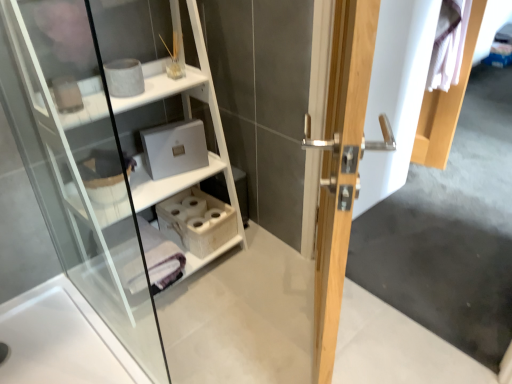
Question: Looking at their shapes, would you say white wood shelf at upper left is wider or thinner than light wood door handle at center?

Choices:
 (A) wide
 (B) thin

Answer: (A)

Question: Based on their sizes in the image, would you say white wood shelf at upper left is bigger or smaller than light wood door handle at center?

Choices:
 (A) small
 (B) big

Answer: (B)

Question: Which object is the closest to the white wood shelf at upper left?

Choices:
 (A) light wood door handle at center
 (B) wooden tissue box at lower center

Answer: (B)

Question: Estimate the real-world distances between objects in this image. Which object is closer to the white wood shelf at upper left?

Choices:
 (A) wooden tissue box at lower center
 (B) light wood door handle at center

Answer: (A)